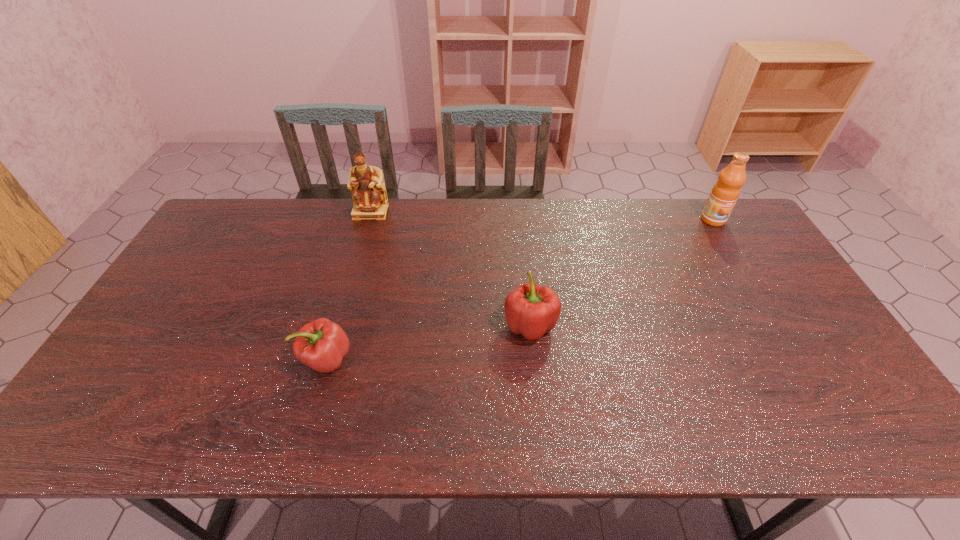
Locate an element on the screen. object that is at the right edge is located at coordinates (725, 192).

At what (x,y) coordinates should I click in order to perform the action: click on object present at the far right corner. Please return your answer as a coordinate pair (x, y). Looking at the image, I should click on (725, 192).

The image size is (960, 540). I want to click on vacant space at the far edge of the desktop, so click(x=473, y=201).

Identify the location of free space at the near edge of the desktop. (720, 425).

Locate an element on the screen. The height and width of the screenshot is (540, 960). vacant space at the left edge is located at coordinates (228, 243).

Locate an element on the screen. vacant space at the right edge of the desktop is located at coordinates (763, 271).

Where is `free space between the left bell pepper and the right bell pepper`? free space between the left bell pepper and the right bell pepper is located at coordinates (428, 342).

This screenshot has width=960, height=540. I want to click on empty space that is in between the fruit juice and the right bell pepper, so click(x=621, y=273).

Where is `vacant area that lies between the fruit juice and the third object from left to right`? This screenshot has width=960, height=540. vacant area that lies between the fruit juice and the third object from left to right is located at coordinates (621, 273).

Find the location of a particular element. free space between the right bell pepper and the rightmost object is located at coordinates (621, 273).